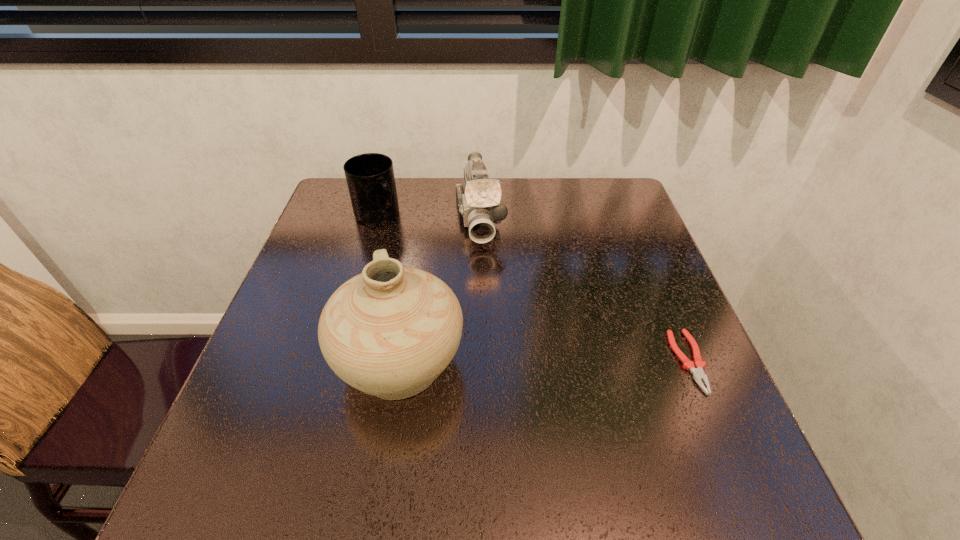
I want to click on pottery, so click(x=390, y=331).

Find the location of a particular element. pliers is located at coordinates (698, 373).

Where is `the rightmost object`? The width and height of the screenshot is (960, 540). the rightmost object is located at coordinates (698, 373).

Where is `the second tallest object`? The image size is (960, 540). the second tallest object is located at coordinates (479, 208).

Locate an element on the screen. The image size is (960, 540). the third tallest object is located at coordinates (370, 177).

Locate an element on the screen. vacant region located on the back of the pottery is located at coordinates (421, 228).

Identify the location of vacant area situated 0.050m on the front of the rightmost object. (713, 421).

The width and height of the screenshot is (960, 540). I want to click on vacant area situated 0.190m on the front-facing side of the camcorder, so click(490, 304).

You are a GUI agent. You are given a task and a screenshot of the screen. Output one action in this format:
    pyautogui.click(x=<x>, y=<y>)
    Task: Click on the free space located 0.390m on the front-facing side of the camcorder
    
    Given the screenshot: What is the action you would take?
    pyautogui.click(x=501, y=379)

Where is `vacant space situated 0.390m on the front-facing side of the camcorder`? vacant space situated 0.390m on the front-facing side of the camcorder is located at coordinates [x=501, y=379].